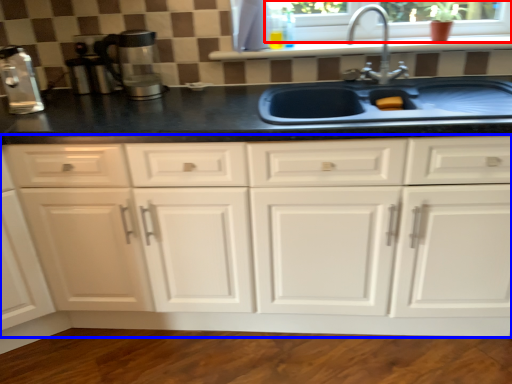
Question: Which object appears farthest to the camera in this image, window frame (highlighted by a red box) or cabinetry (highlighted by a blue box)?

Choices:
 (A) window frame
 (B) cabinetry

Answer: (A)